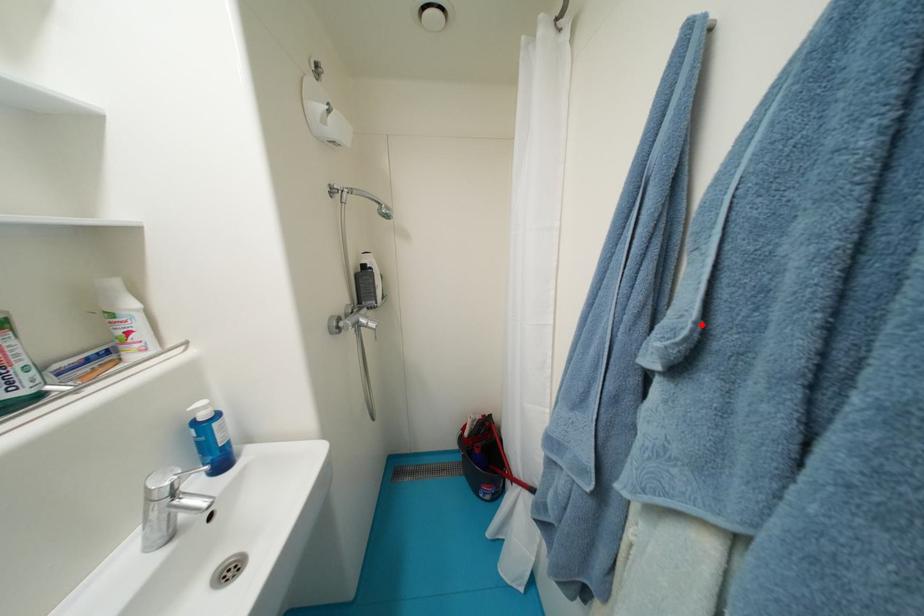
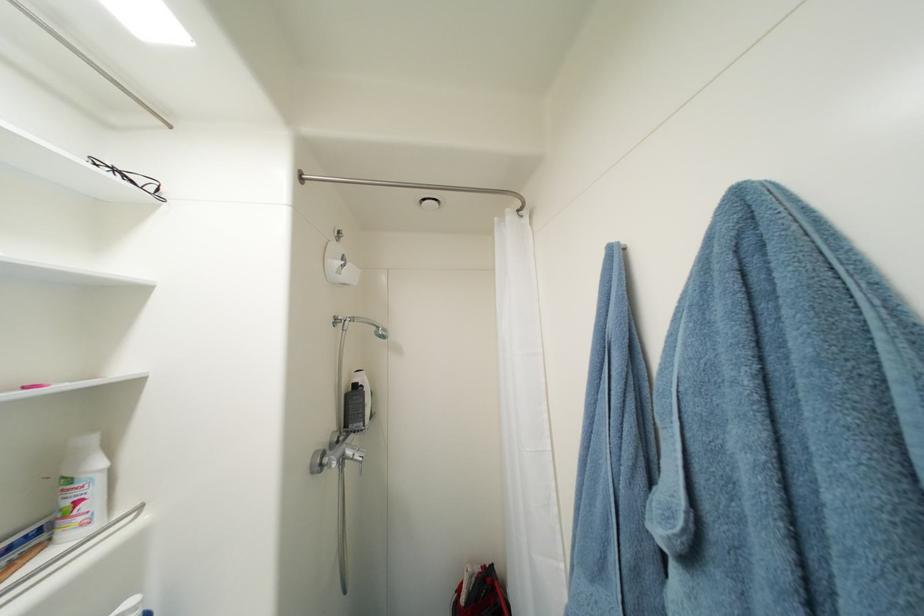
Where in the second image is the point corresponding to the highlighted location from the first image?

(691, 515)